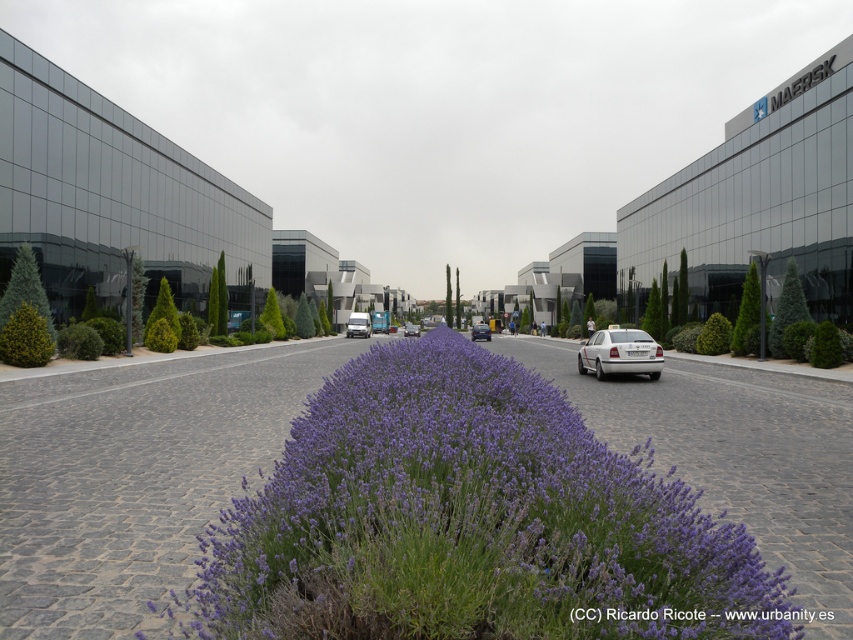
Is point (643, 333) positioned before point (361, 317)?

Yes, it is in front of point (361, 317).

From the picture: Does white matte sedan at center come behind matte white van at center?

No.

In order to click on white matte sedan at center in this screenshot , I will do `click(619, 353)`.

Which is behind, point (635, 346) or point (482, 326)?

The point (482, 326) is more distant.

Does point (618, 360) come in front of point (480, 332)?

Yes, it is in front of point (480, 332).

Find the location of `white matte sedan at center`. white matte sedan at center is located at coordinates (619, 353).

Who is higher up, matte white van at center or metallic silver van at center?

matte white van at center is above.

Can you confirm if matte white van at center is positioned to the left of metallic silver van at center?

Yes, matte white van at center is to the left of metallic silver van at center.

I want to click on matte white van at center, so click(x=358, y=324).